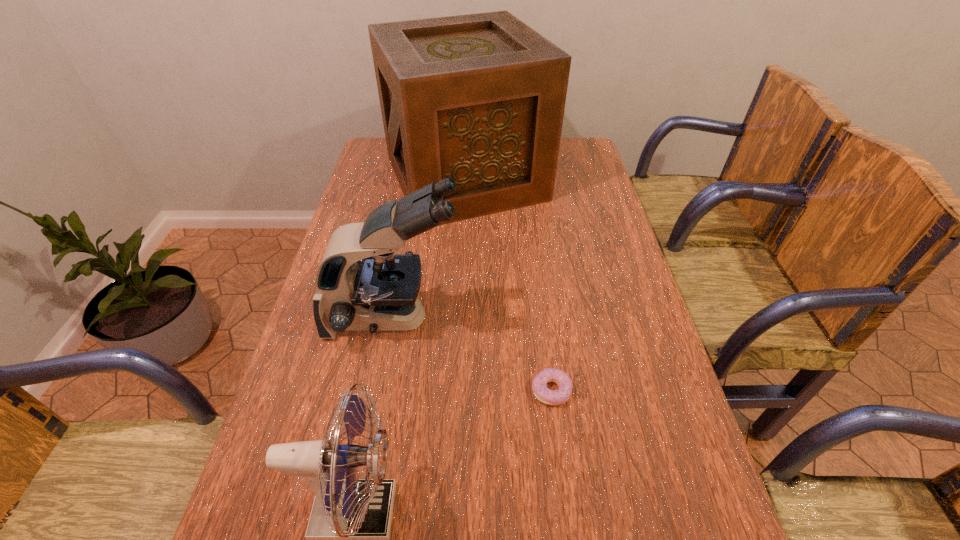
I want to click on microscope present at the left edge, so click(380, 292).

You are a GUI agent. You are given a task and a screenshot of the screen. Output one action in this format:
    pyautogui.click(x=<x>, y=<y>)
    Task: Click on the object present at the far left corner
    The height and width of the screenshot is (540, 960).
    Given the screenshot: What is the action you would take?
    pyautogui.click(x=480, y=98)

Locate an element on the screen. Image resolution: width=960 pixels, height=540 pixels. vacant space at the left edge is located at coordinates (355, 349).

I want to click on vacant space at the right edge of the desktop, so click(610, 334).

The image size is (960, 540). In order to click on free region at the far right corner of the desktop in this screenshot , I will do `click(571, 168)`.

In order to click on unoccupied area between the farthest object and the shortest object in this screenshot , I will do `click(508, 284)`.

Locate an element on the screen. This screenshot has width=960, height=540. vacant space that's between the tallest object and the doughnut is located at coordinates 508,284.

You are a GUI agent. You are given a task and a screenshot of the screen. Output one action in this format:
    pyautogui.click(x=<x>, y=<y>)
    Task: Click on the free space between the tallest object and the doughnut
    The height and width of the screenshot is (540, 960).
    Given the screenshot: What is the action you would take?
    pyautogui.click(x=508, y=284)

I want to click on vacant region between the shortest object and the tallest object, so click(508, 284).

Image resolution: width=960 pixels, height=540 pixels. In order to click on empty space that is in between the tallest object and the second nearest object in this screenshot , I will do `click(508, 284)`.